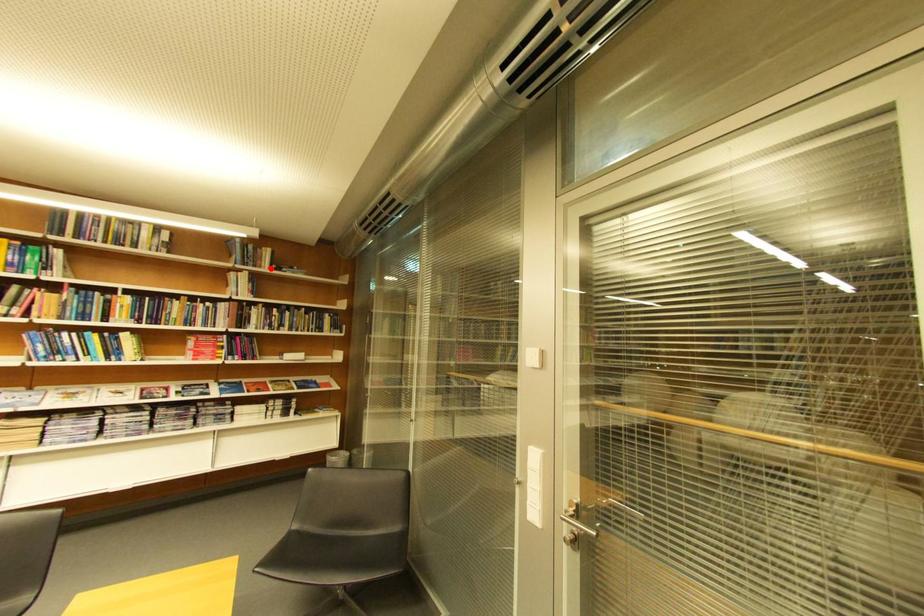
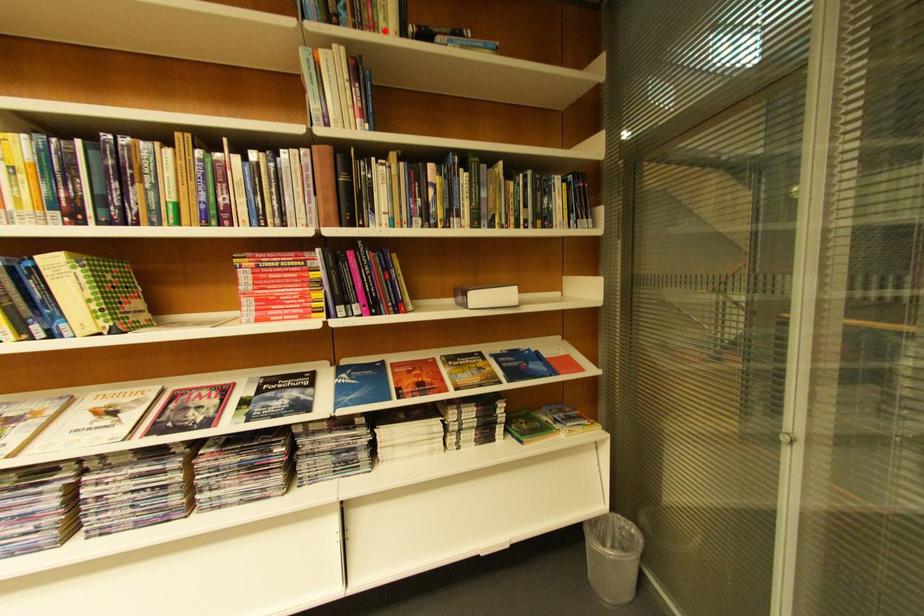
I am providing you with two images of the same scene from different viewpoints. A red point is marked on the first image and another point is marked on the second image. Does the point marked in image1 correspond to the same location as the one in image2?

Yes